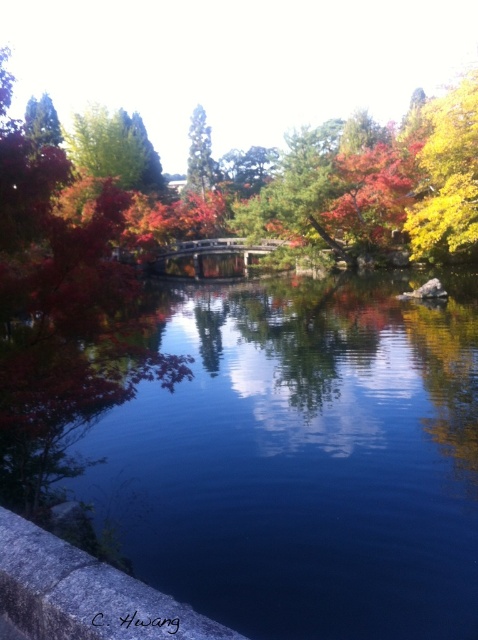
You are standing at the stone ledge in the foreground of the scene. You want to take a photo of the blue glassy river at center. Where should you point your camera to capture it in the frame?

The blue glassy river at center is located at coordinates point (301, 458), so you should aim your camera towards that position to capture it in the frame.

You are standing at the stone ledge in the foreground of the autumn scene. You see the blue glassy river at center and the green matte tree at upper center. Which object is wider in the image?

The blue glassy river at center might be wider than the green matte tree at upper center according to the description.